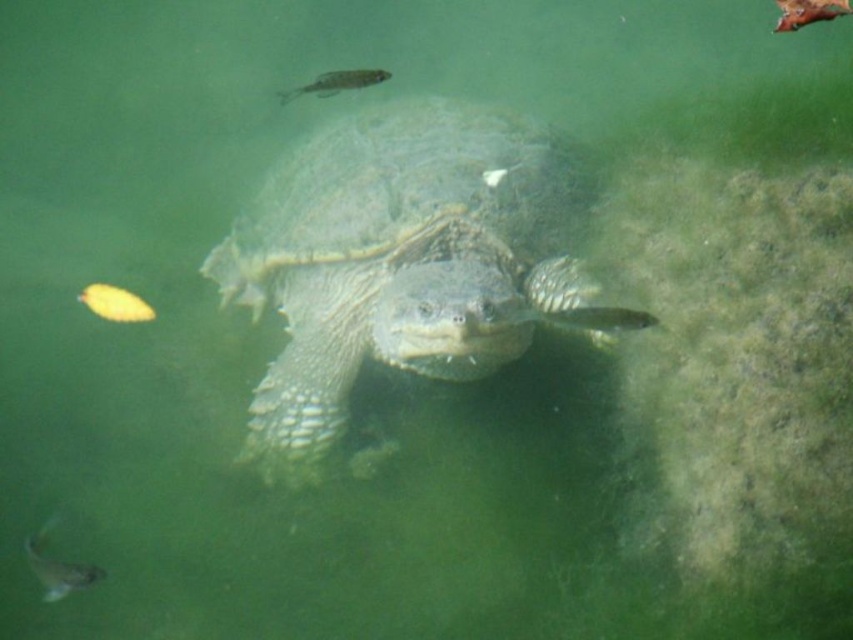
Does yellow matte fish at lower left have a lesser width compared to shiny silver fish at upper center?

No.

Can you confirm if yellow matte fish at lower left is positioned to the right of shiny silver fish at upper center?

Incorrect, yellow matte fish at lower left is not on the right side of shiny silver fish at upper center.

Find the location of a particular element. The width and height of the screenshot is (853, 640). yellow matte fish at lower left is located at coordinates (115, 304).

Which is more to the left, shiny silver fish at lower left or yellow matte fish at lower left?

Positioned to the left is yellow matte fish at lower left.

Where is `shiny silver fish at lower left`? shiny silver fish at lower left is located at coordinates (57, 566).

Where is `shiny silver fish at lower left`? The height and width of the screenshot is (640, 853). shiny silver fish at lower left is located at coordinates (57, 566).

Is point (97, 576) positioned in front of point (386, 74)?

No, (97, 576) is behind (386, 74).

In the scene shown: Can you confirm if shiny silver fish at lower left is smaller than shiny silver fish at upper center?

Actually, shiny silver fish at lower left might be larger than shiny silver fish at upper center.

Which is in front, point (80, 580) or point (312, 88)?

Positioned in front is point (312, 88).

Image resolution: width=853 pixels, height=640 pixels. Identify the location of shiny silver fish at lower left. (57, 566).